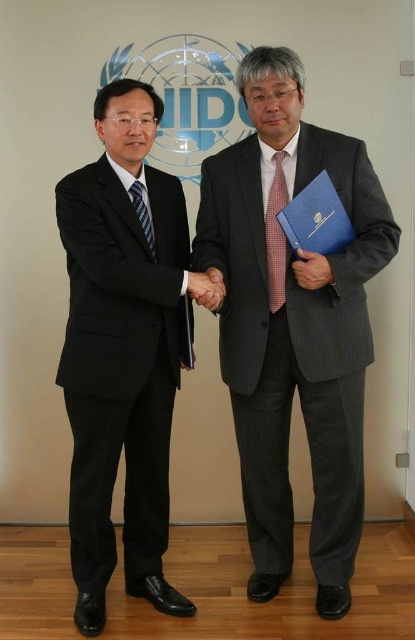
You are an event planner observing the scene. You need to arrange seating for a meeting where the man in the gray pinstripe suit at center and the man in the black matte suit at left will sit across from each other. Based on their current positions, which side should each man sit on to maintain the same relative positioning?

The gray pinstripe suit at center should sit on the right side and the black matte suit at left should sit on the left side to maintain their current relative positioning.

Looking at this image, you are an event planner observing the scene. You need to determine the relative height of the black matte suit at left and the striped silk tie at left. Which one is taller?

The black matte suit at left is taller than the striped silk tie at left.